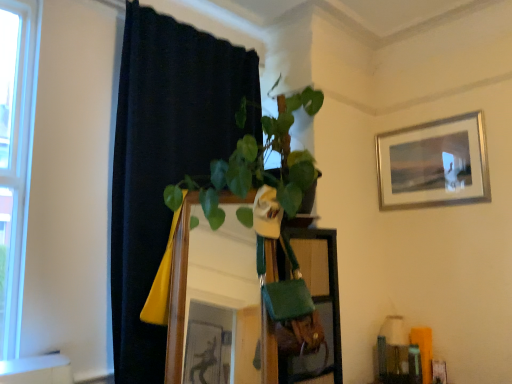
Question: Is point (321, 314) closer or farther from the camera than point (164, 379)?

Choices:
 (A) closer
 (B) farther

Answer: (B)

Question: In terms of size, does green fabric bag at center appear bigger or smaller than wooden mirror at center?

Choices:
 (A) big
 (B) small

Answer: (B)

Question: Estimate the real-world distances between objects in this image. Which object is farther from the green fabric bag at center?

Choices:
 (A) silver metallic picture frame at upper right
 (B) black fabric curtain at left
 (C) wooden mirror at center

Answer: (A)

Question: Which object is positioned closest to the green fabric bag at center?

Choices:
 (A) wooden mirror at center
 (B) black fabric curtain at left
 (C) silver metallic picture frame at upper right

Answer: (A)